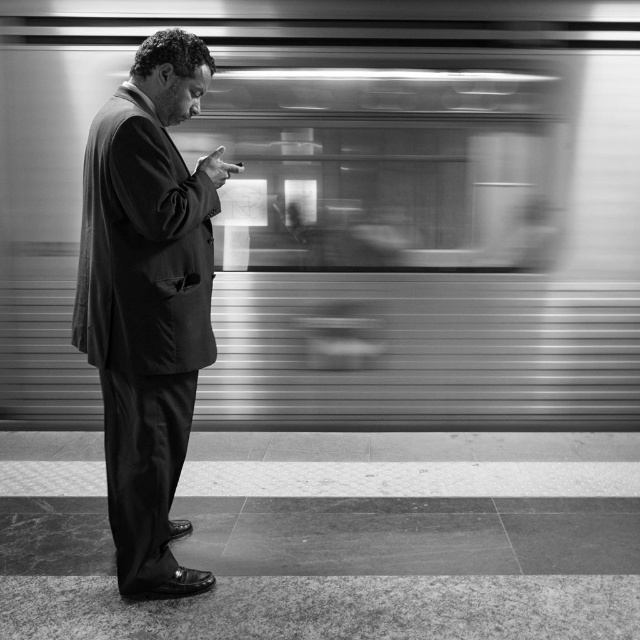
Question: Which of the following is the farthest from the observer?

Choices:
 (A) smooth suit at center
 (B) metallic silver train at center

Answer: (B)

Question: Does metallic silver train at center have a lesser width compared to smooth suit at center?

Choices:
 (A) yes
 (B) no

Answer: (B)

Question: Which object is farther from the camera taking this photo?

Choices:
 (A) smooth suit at center
 (B) metallic silver train at center

Answer: (B)

Question: Is metallic silver train at center positioned behind smooth suit at center?

Choices:
 (A) no
 (B) yes

Answer: (B)

Question: Is metallic silver train at center above smooth suit at center?

Choices:
 (A) no
 (B) yes

Answer: (B)

Question: Which of the following is the closest to the observer?

Choices:
 (A) (80, 88)
 (B) (192, 579)

Answer: (B)